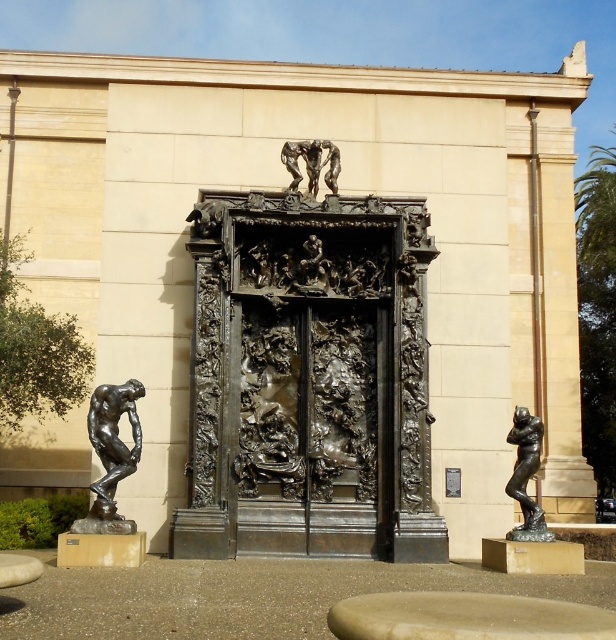
Is point (123, 524) positioned behind point (336, 150)?

No.

Does matte black thinker at left have a lesser width compared to bronze/metallic figure at upper center?

In fact, matte black thinker at left might be wider than bronze/metallic figure at upper center.

Does point (95, 486) come closer to viewer compared to point (317, 179)?

Yes, it is.

This screenshot has width=616, height=640. What are the coordinates of `matte black thinker at left` in the screenshot? It's located at 111,454.

Does matte black thinker at left have a greater height compared to bronze textured figure at right?

No, matte black thinker at left is not taller than bronze textured figure at right.

Is matte black thinker at left wider than bronze textured figure at right?

Yes.

Is point (113, 486) closer to camera compared to point (546, 536)?

Yes, point (113, 486) is in front of point (546, 536).

The height and width of the screenshot is (640, 616). I want to click on matte black thinker at left, so click(x=111, y=454).

Is bronze textured figure at right further to the viewer compared to bronze/metallic figure at upper center?

No.

Does point (516, 413) lie in front of point (334, 147)?

Yes.

Locate an element on the screen. This screenshot has width=616, height=640. bronze textured figure at right is located at coordinates (525, 474).